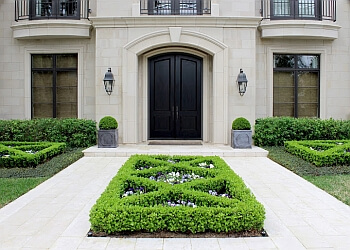
You are a GUI agent. You are given a task and a screenshot of the screen. Output one action in this format:
    pyautogui.click(x=<x>, y=<y>)
    Task: Click on the black doors
    This screenshot has height=250, width=350.
    Given the screenshot: What is the action you would take?
    pyautogui.click(x=164, y=87), pyautogui.click(x=186, y=88)